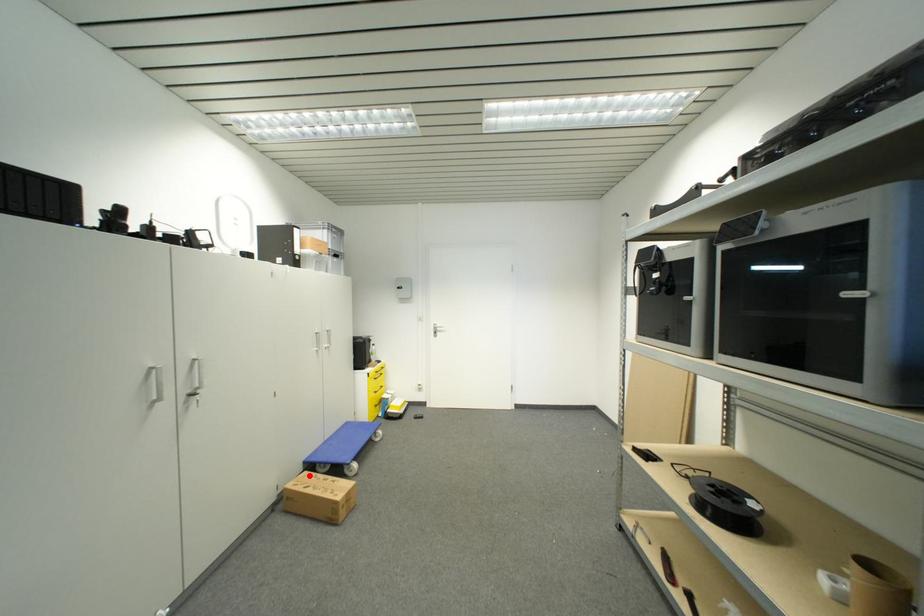
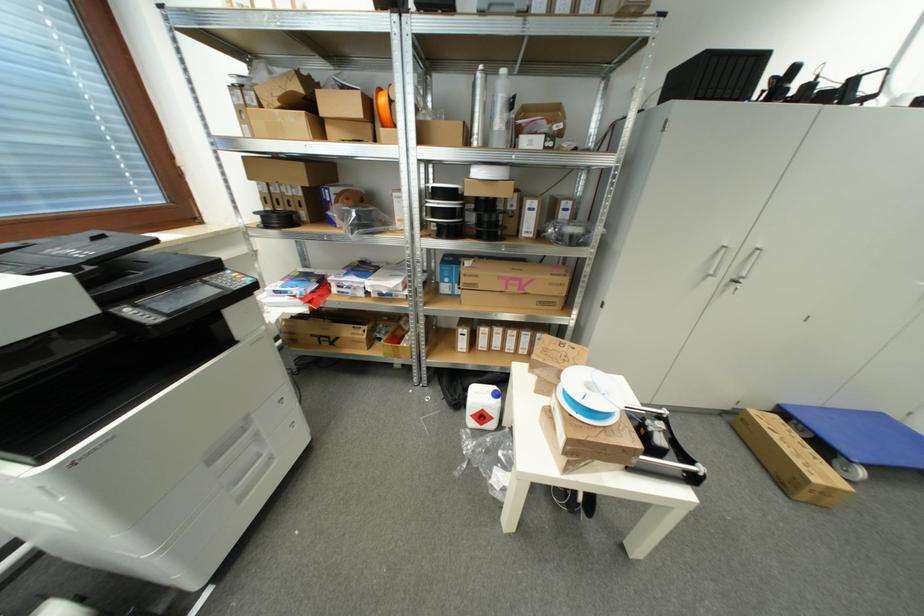
Question: I am providing you with two images of the same scene from different viewpoints. Image1 has a red point marked. In image2, the corresponding 3D location appears at what relative position? Reply with the corresponding letter.

Choices:
 (A) Closer
 (B) Farther

Answer: (A)